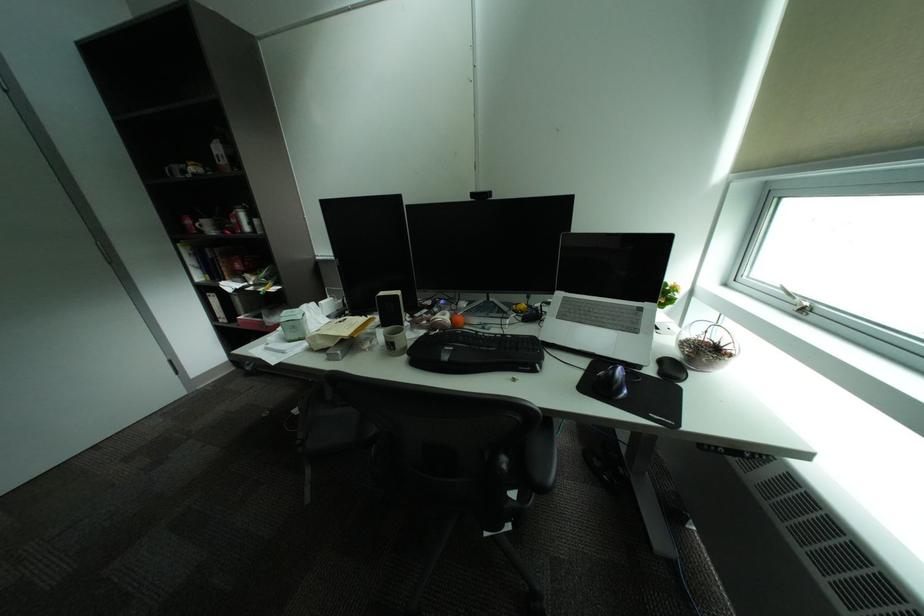
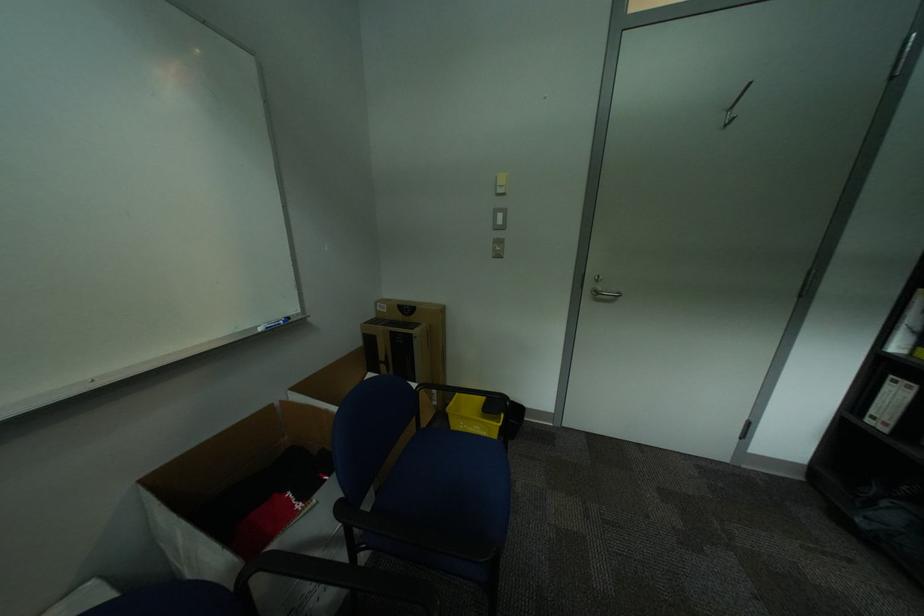
How did the camera likely rotate?

The rotation direction of the camera is left-down.